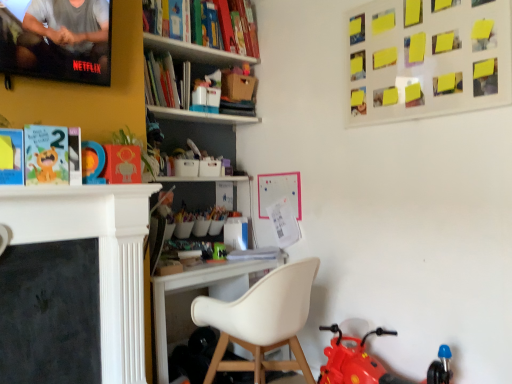
Question: From the image's perspective, is matte plastic number at center, the second toy when ordered from back to front, located above or below rubberized red toy motorcycle at lower right, which is the 1th toy from right to left?

Choices:
 (A) above
 (B) below

Answer: (A)

Question: Considering the relative positions of matte plastic number at center, the second toy when ordered from back to front, and rubberized red toy motorcycle at lower right, which is counted as the 3th toy, starting from the back, in the image provided, is matte plastic number at center, the second toy when ordered from back to front, to the left or to the right of rubberized red toy motorcycle at lower right, which is counted as the 3th toy, starting from the back,?

Choices:
 (A) right
 (B) left

Answer: (B)

Question: Based on their relative distances, which object is nearer to the green plastic toy at center, marked as the 3th toy in a front-to-back arrangement?

Choices:
 (A) white matte chair at center
 (B) matte plastic number at center, the third toy positioned from the right
 (C) rubberized red toy motorcycle at lower right, which is the 1th toy from right to left
 (D) yellow paper at upper right
 (E) matte paper book at left

Answer: (A)

Question: Which of these objects is positioned farthest from the white matte chair at center?

Choices:
 (A) yellow paper at upper right
 (B) matte plastic number at center, the first toy when ordered from top to bottom
 (C) green plastic toy at center, the first toy in the back-to-front sequence
 (D) matte paper book at left
 (E) rubberized red toy motorcycle at lower right, which is counted as the 3th toy, starting from the back

Answer: (A)